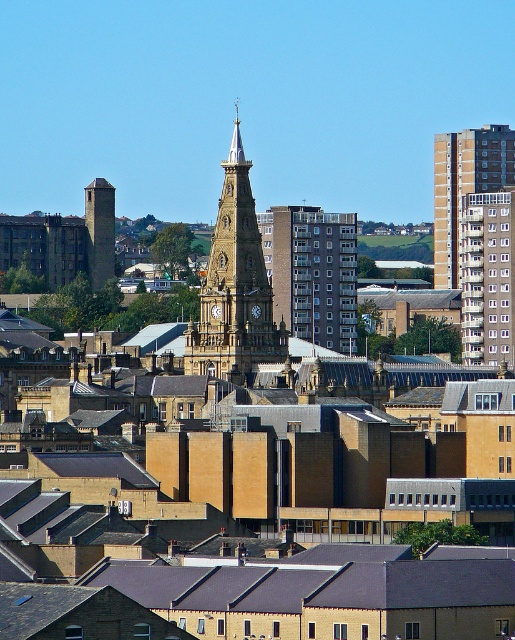
Between golden stone clock tower at center and brown concrete building at upper right, which one has more height?

With more height is golden stone clock tower at center.

Between point (247, 163) and point (472, 180), which one is positioned in front?

Point (247, 163) is in front.

The image size is (515, 640). Find the location of `golden stone clock tower at center`. golden stone clock tower at center is located at coordinates (234, 288).